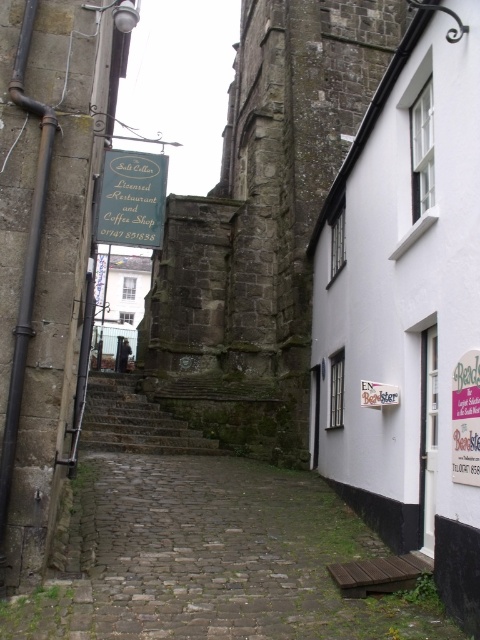
You are standing at the entrance of the alleyway and want to take a photo of the stone textured tower at center. According to the scene description, where should you position yourself to capture the tower in the center of your photo?

To capture the stone textured tower at center in the center of your photo, position yourself directly in front of the tower, as its 2D location is at point [262,225], which is the central area of the scene.

You are standing in the alleyway and want to walk towards the stone structure at the end. Which point, point (x=214, y=282) or point (x=134, y=161), is closer to your current position?

Point (x=214, y=282) is closer to your current position because it is further to the viewer than point (x=134, y=161), meaning it is nearer to you as you stand in the alleyway.